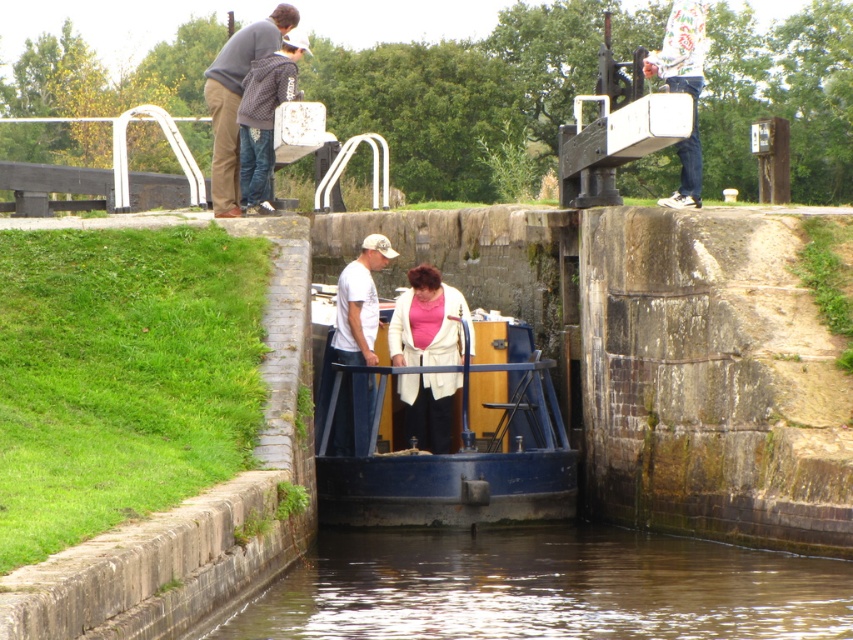
Does matte white coat at center come behind white printed sweater at upper center?

That is True.

Is matte white coat at center smaller than white printed sweater at upper center?

Indeed, matte white coat at center has a smaller size compared to white printed sweater at upper center.

What do you see at coordinates (427, 321) in the screenshot? The height and width of the screenshot is (640, 853). I see `matte white coat at center` at bounding box center [427, 321].

The image size is (853, 640). In order to click on matte white coat at center in this screenshot , I will do `click(427, 321)`.

Can you confirm if blue polished wood boat at center is positioned to the left of white printed sweater at upper center?

Indeed, blue polished wood boat at center is positioned on the left side of white printed sweater at upper center.

Does point (509, 324) lie behind point (688, 180)?

Yes, it is behind point (688, 180).

Locate an element on the screen. blue polished wood boat at center is located at coordinates (463, 458).

Between point (322, 592) and point (396, 300), which one is positioned behind?

Point (396, 300)

Does brown murky water at lower center appear on the right side of matte white coat at center?

Yes, brown murky water at lower center is to the right of matte white coat at center.

This screenshot has width=853, height=640. I want to click on brown murky water at lower center, so click(x=546, y=588).